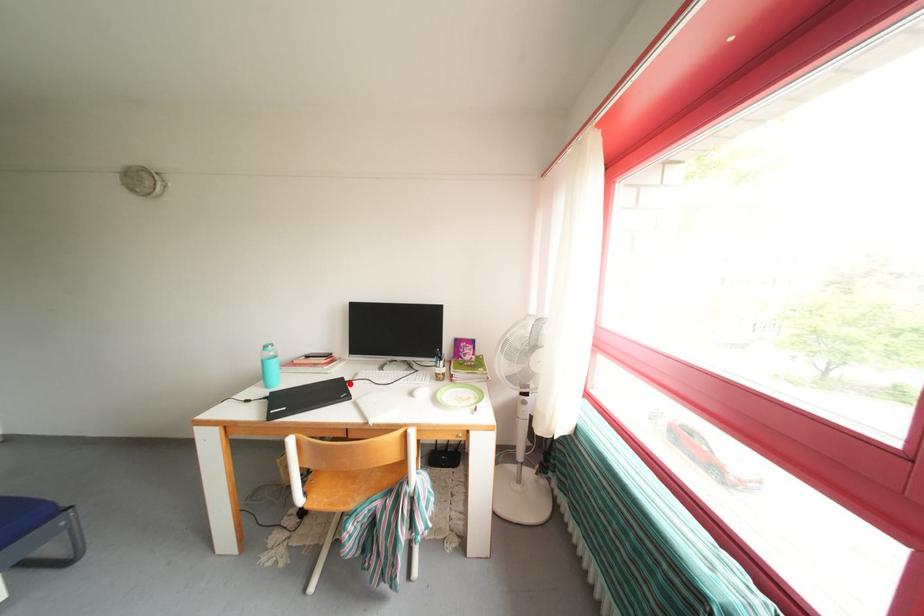
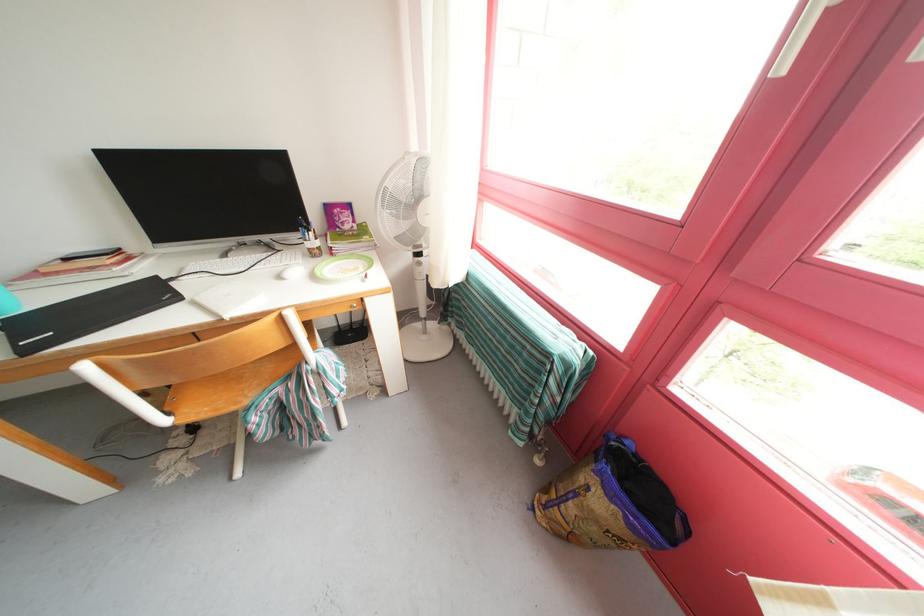
Question: I am providing you with two images of the same scene from different viewpoints. A red point is marked on the first image. Is the red point's position out of view in image 2?

Choices:
 (A) Yes
 (B) No

Answer: (B)